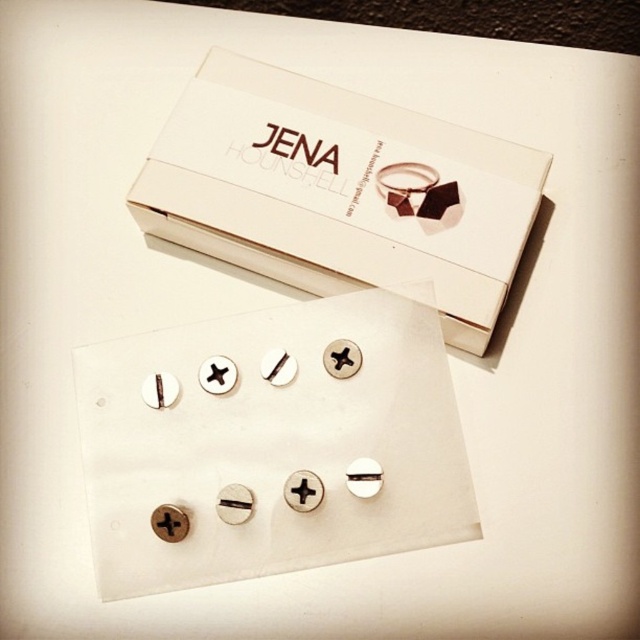
You are examining the jewelry components on the white card. There are two points marked on the card at coordinates point [164,442] and point [289,237]. If you were to touch these points with your finger, which one would feel closer to you?

Point [164,442] is closer to the viewer than point [289,237], so touching it would feel closer.

You are trying to assemble a piece of jewelry using the components shown. The silver metallic screws at center need to be secured into place. Where should you look on the white cardboard box at upper center for instructions?

The silver metallic screws at center are positioned under the white cardboard box at upper center, so you should check the bottom or underside of the white cardboard box at upper center for instructions related to securing the screws.

You are a jeweler examining the jewelry components. You need to determine which object is larger between the silver metallic screws at center and the white cardboard box at upper center. Which one is bigger?

The silver metallic screws at center is bigger than the white cardboard box at upper center according to the description.